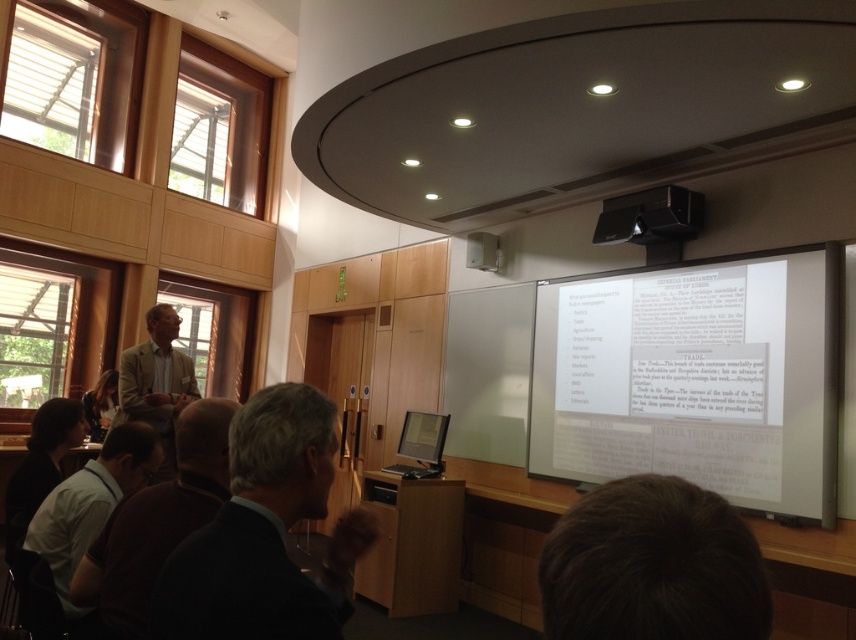
Question: Where is dark brown shirt at lower left located in relation to light beige suit at center in the image?

Choices:
 (A) right
 (B) left

Answer: (A)

Question: Does dark brown shirt at lower left appear over matte black monitor at center?

Choices:
 (A) no
 (B) yes

Answer: (B)

Question: Can you confirm if dark brown shirt at lower left is positioned below black plastic projector at upper center?

Choices:
 (A) yes
 (B) no

Answer: (A)

Question: Which point is closer to the camera?

Choices:
 (A) light beige suit at center
 (B) dark suit at center
 (C) matte black monitor at center
 (D) dark brown shirt at lower left

Answer: (B)

Question: Which point appears farthest from the camera in this image?

Choices:
 (A) (149, 310)
 (B) (253, 506)

Answer: (A)

Question: Which point is farther from the camera taking this photo?

Choices:
 (A) (165, 465)
 (B) (60, 516)
 (C) (432, 419)
 (D) (821, 465)

Answer: (C)